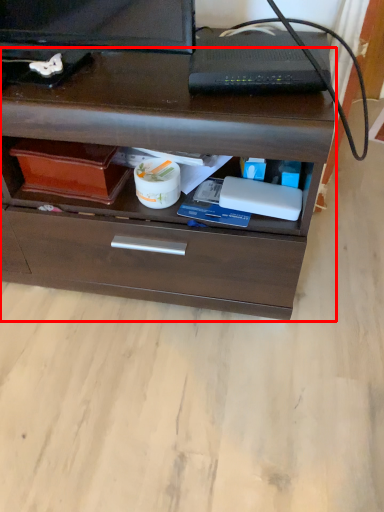
Question: Observing the image, what is the correct spatial positioning of chest of drawers (annotated by the red box) in reference to appliance?

Choices:
 (A) left
 (B) right

Answer: (A)